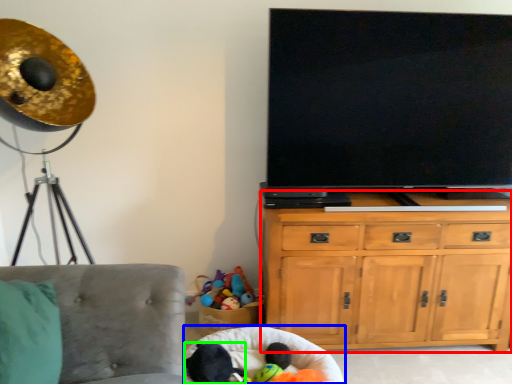
Question: Which object is the farthest from cabinetry (highlighted by a red box)? Choose among these: bean bag chair (highlighted by a blue box) or animal (highlighted by a green box).

Choices:
 (A) bean bag chair
 (B) animal

Answer: (B)